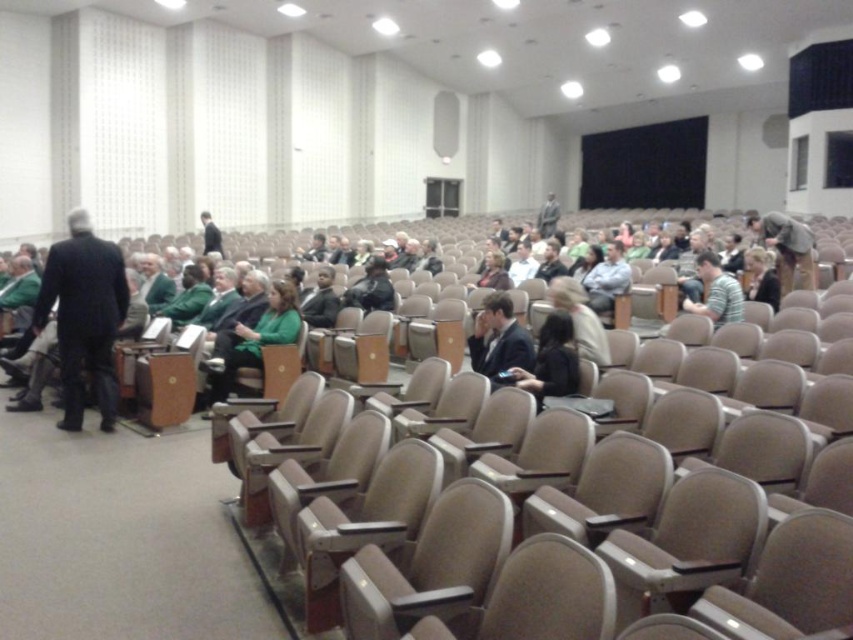
You are organizing a fire drill in this lecture hall and need to know the distance between the dark suit at center and the brown leather jacket at center. Is there enough space between them for a person to walk through comfortably?

The dark suit at center and the brown leather jacket at center are 3.89 meters apart, so yes, there is enough space between them for a person to walk through comfortably.

You are organizing a seating arrangement in the lecture hall and need to place two identical tables between the dark suit at left and the dark suit at center. Each table requires 1 meter of space. Can you fit both tables between them?

The dark suit at left is wider than the dark suit at center. However, the description only provides information about their widths, not the distance between them. Without knowing the actual distance between the two individuals, it is impossible to determine if both tables can fit.